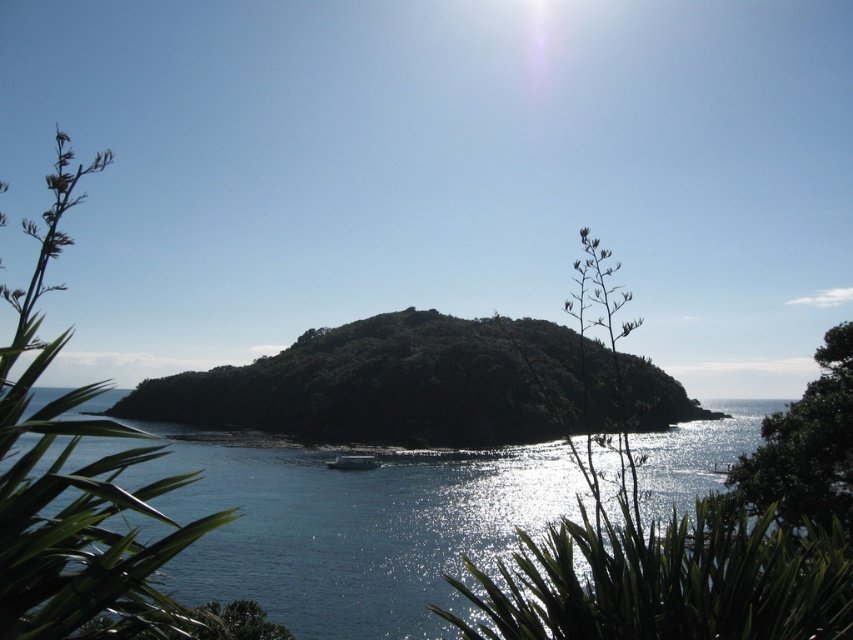
Question: Which object appears closest to the camera in this image?

Choices:
 (A) green leafy plant at lower center
 (B) green leafy plant at right
 (C) green leafy island at center

Answer: (A)

Question: Is the position of green leafy plant at lower center more distant than that of green leafy plant at right?

Choices:
 (A) no
 (B) yes

Answer: (A)

Question: Does green leafy island at center appear over green leafy plant at lower center?

Choices:
 (A) yes
 (B) no

Answer: (A)

Question: Does blue liquid water at center appear under green leafy island at center?

Choices:
 (A) yes
 (B) no

Answer: (A)

Question: Which object is closer to the camera taking this photo?

Choices:
 (A) green leafy plant at lower center
 (B) green leafy island at center

Answer: (A)

Question: Estimate the real-world distances between objects in this image. Which object is farther from the green leafy plant at lower center?

Choices:
 (A) green leafy plant at right
 (B) blue liquid water at center

Answer: (B)